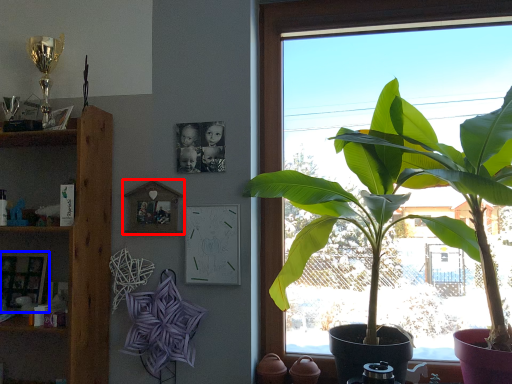
Question: Which point is further to the camera, picture frame (highlighted by a red box) or picture frame (highlighted by a blue box)?

Choices:
 (A) picture frame
 (B) picture frame

Answer: (B)